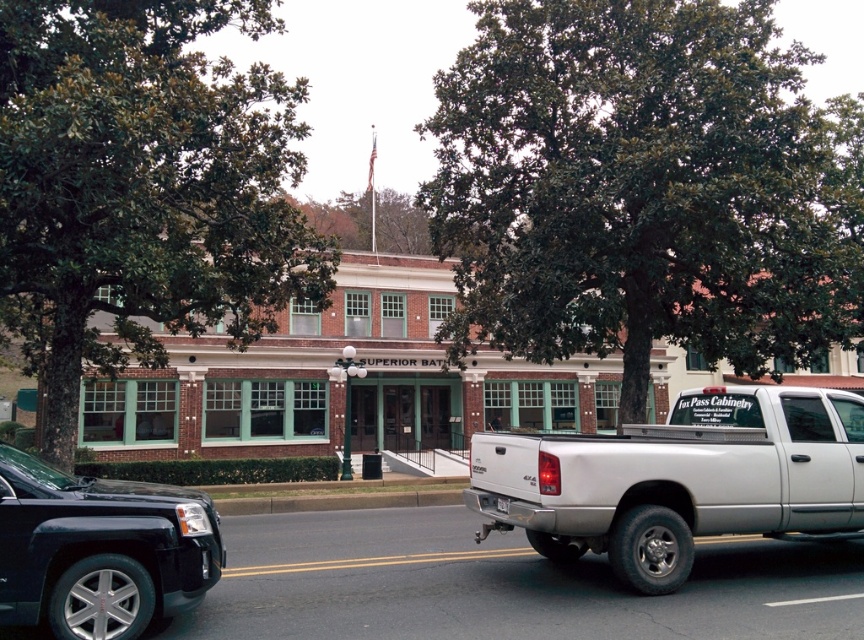
You are a delivery driver approaching the Superior Bath building. You need to park your silver metallic truck at right near the curb. However, there is a green leafy tree at center blocking part of the parking spot. Which side of the truck should you park closer to avoid hitting the tree?

The green leafy tree at center is positioned on the right side of silver metallic truck at right. To avoid hitting the tree, you should park the silver metallic truck at right closer to the left side of the parking spot.

You are a delivery driver approaching the Superior Bath building. You need to park your silver metallic truck at right near the sidewalk. However, there is a green leafy tree at center blocking part of the parking space. Can you estimate if the truck will fit between the tree and the building without damaging the tree?

The green leafy tree at center might be wider than the silver metallic truck at right, so there is a possibility that the truck may not fit without damaging the tree. It is recommended to choose a different parking spot.